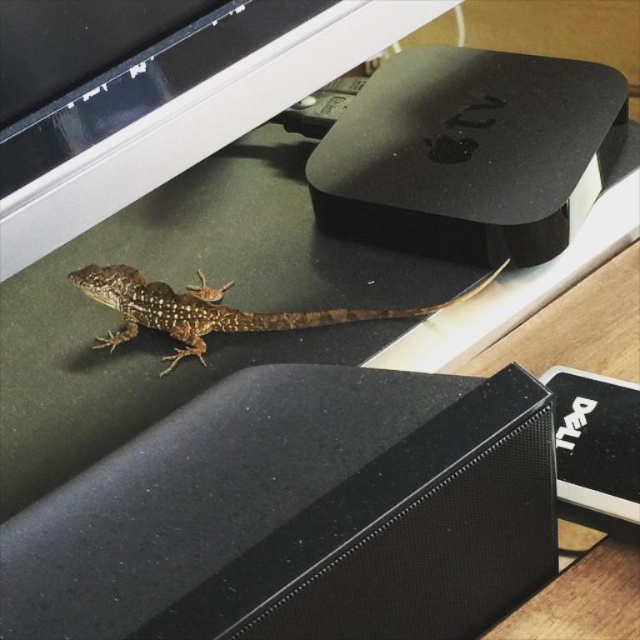
You are trying to place a small plant pot on the desk. The lizard is currently at point (300, 515). Where should you place the plant pot so it doesn

The black matte speaker is located at point (300, 515). To place the plant pot, choose a different spot on the desk away from this point to avoid disturbing the lizard.

You are organizing items on a desk and need to place a new object between the black matte speaker at lower center and the brown scaly lizard at lower left. Is there enough space between them to fit a small notebook?

The black matte speaker at lower center is to the right of the brown scaly lizard at lower left, so there is space between them. A small notebook can be placed between the black matte speaker at lower center and the brown scaly lizard at lower left.

You are trying to locate the black matte speaker at lower center on the desk. According to the coordinates given, where exactly is it positioned?

The black matte speaker at lower center is positioned at point (300, 515).